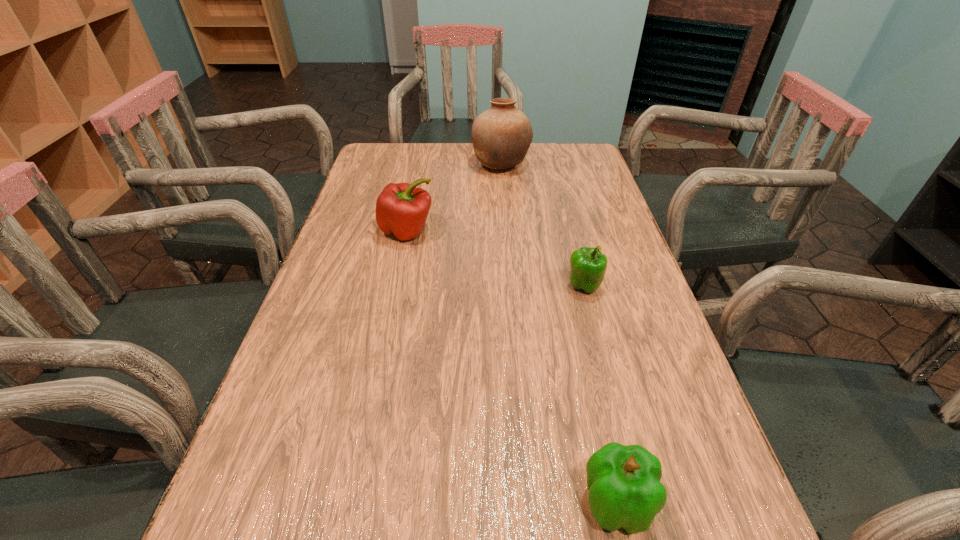
You are a GUI agent. You are given a task and a screenshot of the screen. Output one action in this format:
    pyautogui.click(x=<x>, y=<y>)
    Task: Click on the object that is positioned at the right edge
    
    Given the screenshot: What is the action you would take?
    pyautogui.click(x=588, y=266)

In the image, there is a desktop. Where is `free region at the far edge`? free region at the far edge is located at coordinates (474, 153).

I want to click on free space at the left edge of the desktop, so click(337, 327).

Image resolution: width=960 pixels, height=540 pixels. In the image, there is a desktop. In order to click on vacant area at the right edge in this screenshot , I will do `click(608, 296)`.

In the image, there is a desktop. At what (x,y) coordinates should I click in order to perform the action: click on vacant space at the far left corner. Please return your answer as a coordinate pair (x, y). Looking at the image, I should click on (372, 155).

The height and width of the screenshot is (540, 960). In order to click on free space between the farthest bell pepper and the tallest object in this screenshot , I will do `click(454, 198)`.

This screenshot has height=540, width=960. Find the location of `free space between the farthest object and the leftmost object`. free space between the farthest object and the leftmost object is located at coordinates (454, 198).

Find the location of a particular element. The height and width of the screenshot is (540, 960). vacant space that is in between the tallest object and the farthest bell pepper is located at coordinates (454, 198).

This screenshot has width=960, height=540. I want to click on free spot between the second farthest bell pepper and the second farthest object, so click(x=495, y=259).

This screenshot has height=540, width=960. What are the coordinates of `object that stands as the closest to the tallest object` in the screenshot? It's located at (401, 209).